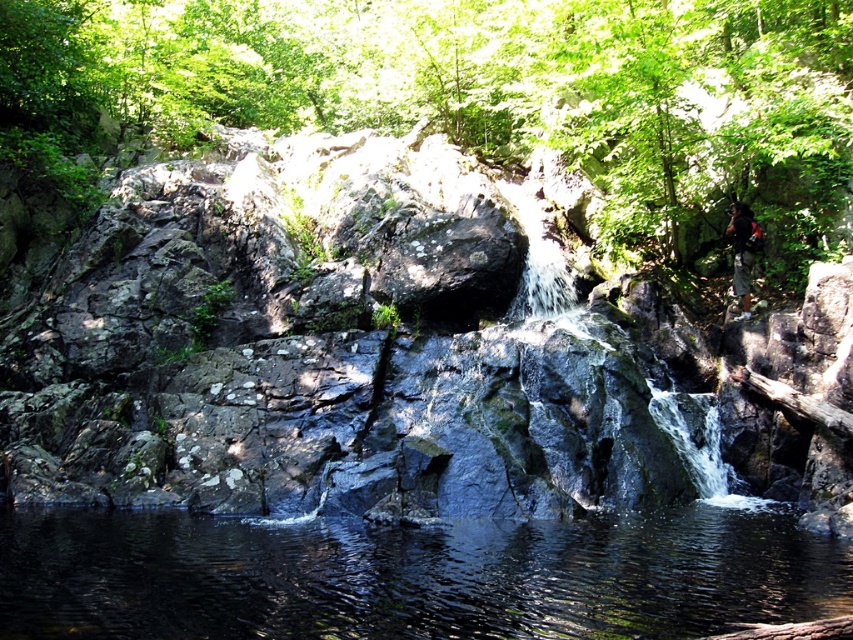
Does clear water at center have a greater height compared to dark brown leather backpack at right?

No.

Can you confirm if clear water at center is smaller than dark brown leather backpack at right?

Actually, clear water at center might be larger than dark brown leather backpack at right.

Find the location of `clear water at center`. clear water at center is located at coordinates (410, 576).